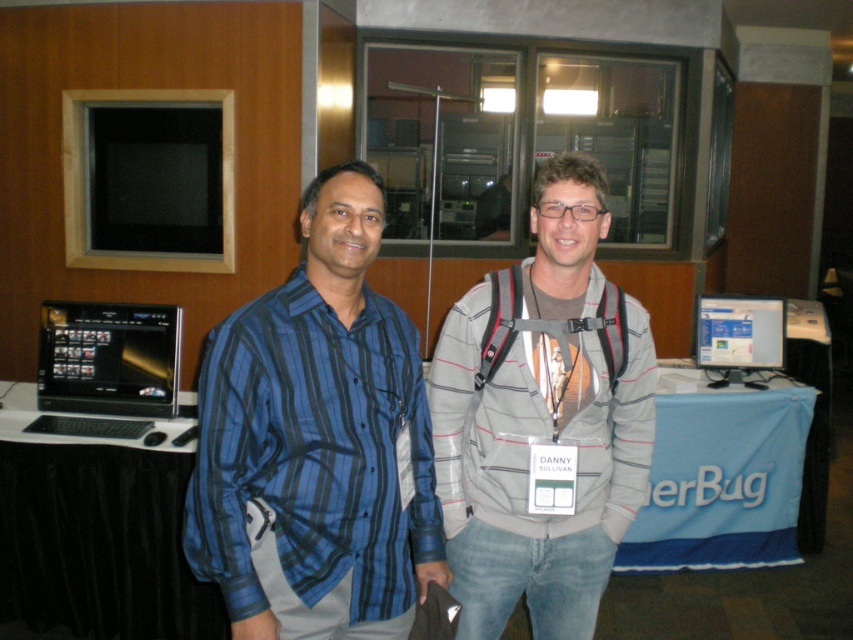
Question: Can you confirm if blue striped shirt at center is positioned to the left of black fabric table at center?

Choices:
 (A) yes
 (B) no

Answer: (A)

Question: Which point appears farthest from the camera in this image?

Choices:
 (A) (401, 561)
 (B) (109, 374)
 (C) (727, 336)

Answer: (C)

Question: Which point is closer to the camera?

Choices:
 (A) (734, 368)
 (B) (593, 612)
 (C) (166, 337)
 (D) (386, 580)

Answer: (D)

Question: Considering the relative positions of gray striped hoodie at center and matte black monitor at center in the image provided, where is gray striped hoodie at center located with respect to matte black monitor at center?

Choices:
 (A) right
 (B) left

Answer: (B)

Question: Does blue striped shirt at center have a smaller size compared to matte black monitor at center?

Choices:
 (A) yes
 (B) no

Answer: (B)

Question: Which object is the farthest from the blue striped shirt at center?

Choices:
 (A) black fabric table at center
 (B) matte black monitor at center

Answer: (B)